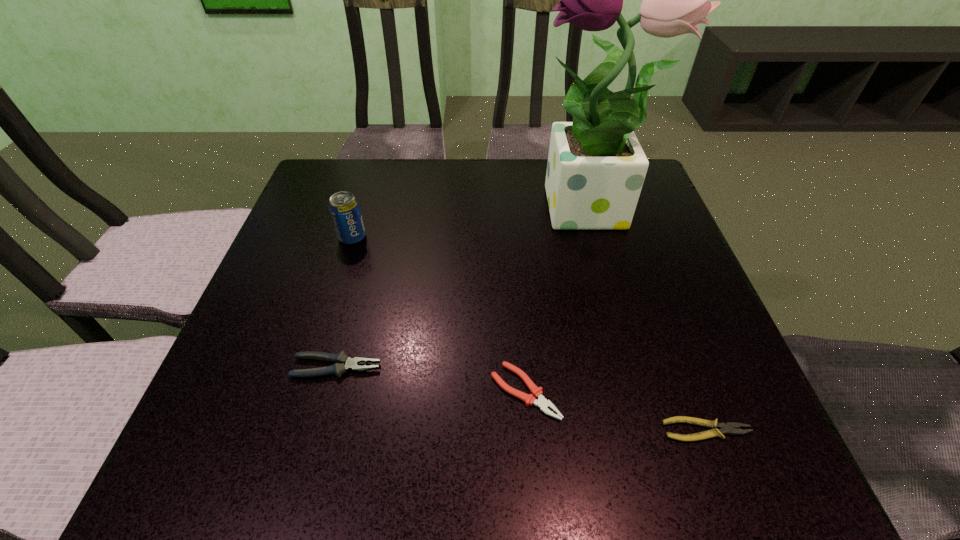
Where is `the tallest object`? the tallest object is located at coordinates (596, 168).

At what (x,y) coordinates should I click in order to perform the action: click on the fourth shortest object. Please return your answer as a coordinate pair (x, y). This screenshot has width=960, height=540. Looking at the image, I should click on (344, 208).

Find the location of a particular element. The image size is (960, 540). the tallest pliers is located at coordinates (343, 363).

The image size is (960, 540). What are the coordinates of `the third shortest object` in the screenshot? It's located at (343, 363).

I want to click on the second shortest pliers, so click(x=530, y=399).

You are a GUI agent. You are given a task and a screenshot of the screen. Output one action in this format:
    pyautogui.click(x=<x>, y=<y>)
    Task: Click on the fourth tallest object
    
    Given the screenshot: What is the action you would take?
    pyautogui.click(x=530, y=399)

Locate an element on the screen. The height and width of the screenshot is (540, 960). the shortest pliers is located at coordinates (731, 427).

Identify the location of the shortest object. The width and height of the screenshot is (960, 540). (731, 427).

You are a GUI agent. You are given a task and a screenshot of the screen. Output one action in this format:
    pyautogui.click(x=<x>, y=<y>)
    Task: Click on the free point located 0.280m on the front-facing side of the tallest object
    This screenshot has height=540, width=960.
    Given the screenshot: What is the action you would take?
    pyautogui.click(x=415, y=212)

Where is `vacant region located 0.330m on the front-facing side of the tallest object`? The width and height of the screenshot is (960, 540). vacant region located 0.330m on the front-facing side of the tallest object is located at coordinates (394, 212).